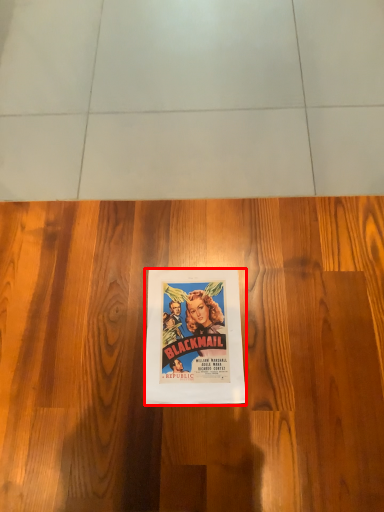
Question: From the image's perspective, where is poster (annotated by the red box) located relative to hardwood?

Choices:
 (A) above
 (B) below

Answer: (B)